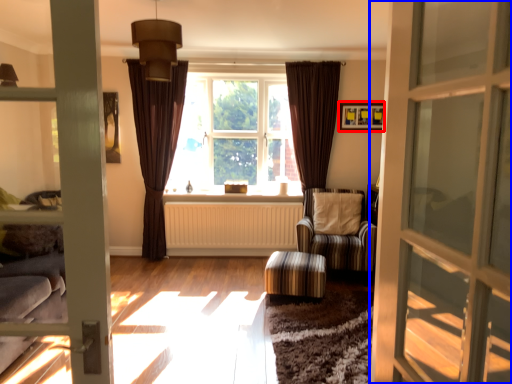
Question: Which point is closer to the camera, picture frame (highlighted by a red box) or door (highlighted by a blue box)?

Choices:
 (A) picture frame
 (B) door

Answer: (B)